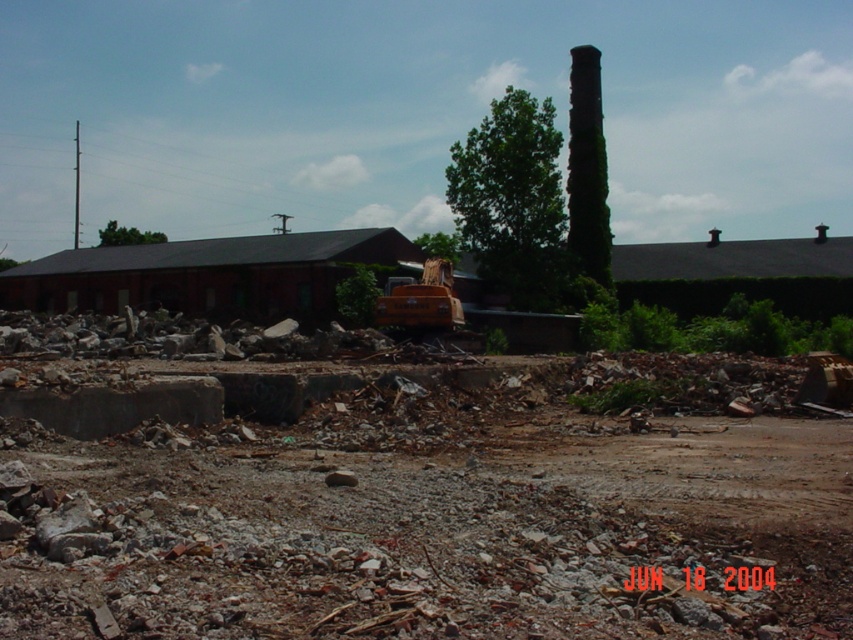
Is brown dirt track at center below orange rubber excavator at center?

Yes, brown dirt track at center is below orange rubber excavator at center.

Does brown dirt track at center have a lesser width compared to orange rubber excavator at center?

In fact, brown dirt track at center might be wider than orange rubber excavator at center.

Identify the location of brown dirt track at center. (434, 518).